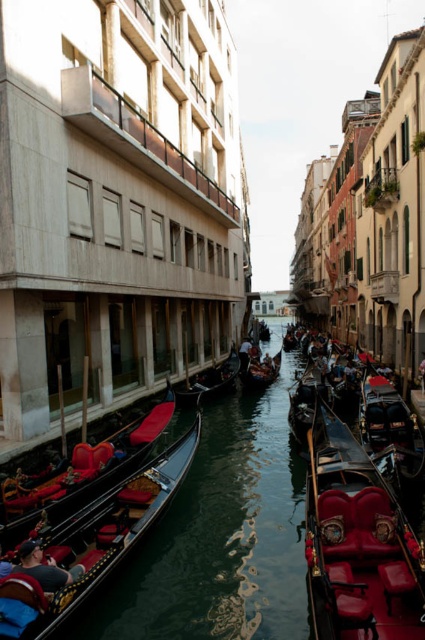
Does polished wood gondola at center lie in front of shiny black gondola at right?

Yes.

This screenshot has height=640, width=425. Find the location of `polished wood gondola at center`. polished wood gondola at center is located at coordinates (357, 541).

Is point (323, 548) closer to camera compared to point (234, 381)?

Yes, it is in front of point (234, 381).

Can you confirm if polished wood gondola at center is positioned above wooden gondola at center?

No, polished wood gondola at center is not above wooden gondola at center.

In the scene shown: Who is more forward, (351,548) or (178,396)?

Positioned in front is point (351,548).

You are a GUI agent. You are given a task and a screenshot of the screen. Output one action in this format:
    pyautogui.click(x=<x>, y=<y>)
    Task: Click on the polished wood gondola at center
    This screenshot has height=640, width=425.
    Given the screenshot: What is the action you would take?
    pyautogui.click(x=357, y=541)

Is shiny black gondola at right taller than wooden gondola at center?

Yes.

You are a GUI agent. You are given a task and a screenshot of the screen. Output one action in this format:
    pyautogui.click(x=<x>, y=<y>)
    Task: Click on the shiny black gondola at right
    
    Given the screenshot: What is the action you would take?
    pyautogui.click(x=388, y=429)